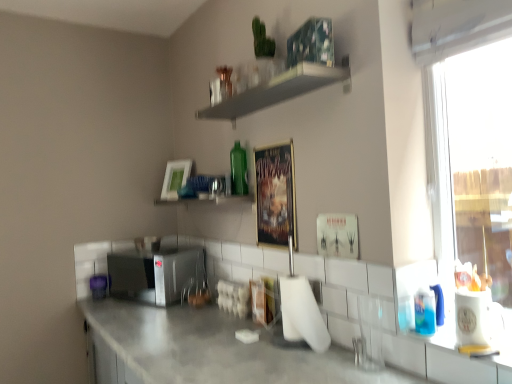
At what (x,y) coordinates should I click in order to perform the action: click on metallic poster at center, arranged as the 1th picture frame when viewed from the right. Please return your answer as a coordinate pair (x, y). Looking at the image, I should click on (275, 195).

Describe the element at coordinates (175, 178) in the screenshot. I see `white matte picture frame at upper center, placed as the 1th picture frame when sorted from left to right` at that location.

How much space does white matte picture frame at upper center, placed as the 1th picture frame when sorted from left to right, occupy vertically?

The height of white matte picture frame at upper center, placed as the 1th picture frame when sorted from left to right, is 29.55 centimeters.

What is the approximate height of transparent glass window at right?

transparent glass window at right is 3.45 feet in height.

Describe the element at coordinates (157, 274) in the screenshot. This screenshot has width=512, height=384. I see `satin silver microwave at center` at that location.

Measure the distance between green glass bottle at upper center and camera.

green glass bottle at upper center is 6.26 feet from camera.

The image size is (512, 384). What are the coordinates of `metallic poster at center, arranged as the 1th picture frame when viewed from the right` in the screenshot? It's located at tap(275, 195).

Is satin silver microwave at center inside or outside of metallic poster at center, the 2th picture frame when ordered from left to right?

satin silver microwave at center cannot be found inside metallic poster at center, the 2th picture frame when ordered from left to right.

From the image's perspective, between satin silver microwave at center and metallic poster at center, the 2th picture frame when ordered from back to front, who is located below?

satin silver microwave at center is shown below in the image.

From a real-world perspective, which object stands above the other?

metallic poster at center, the 1th picture frame from the front.

The height and width of the screenshot is (384, 512). Identify the location of the 2nd picture frame to the right of the satin silver microwave at center, starting your count from the anchor. (275, 195).

Does green glass bottle at upper center lie in front of white matte shelf at upper center, the second shelf when ordered from bottom to top?

No, green glass bottle at upper center is further to the viewer.

Identify the location of the 2nd shelf in front of the green glass bottle at upper center, starting your count from the anchor. (278, 90).

Is point (241, 170) farther from viewer compared to point (265, 100)?

Yes.

Is green glass bottle at upper center far away from white matte shelf at upper center, the 1th shelf when ordered from top to bottom?

No, there isn't a large distance between green glass bottle at upper center and white matte shelf at upper center, the 1th shelf when ordered from top to bottom.

Considering the relative sizes of transparent glass window at right and metallic poster at center, the 2th picture frame when ordered from back to front, in the image provided, is transparent glass window at right thinner than metallic poster at center, the 2th picture frame when ordered from back to front,?

No, transparent glass window at right is not thinner than metallic poster at center, the 2th picture frame when ordered from back to front.

Is transparent glass window at right positioned beyond the bounds of metallic poster at center, the 2th picture frame when ordered from back to front?

Yes, transparent glass window at right is outside of metallic poster at center, the 2th picture frame when ordered from back to front.

From a real-world perspective, is transparent glass window at right physically below metallic poster at center, the 2th picture frame when ordered from left to right?

Actually, transparent glass window at right is physically above metallic poster at center, the 2th picture frame when ordered from left to right, in the real world.

Which is in front, transparent glass window at right or metallic poster at center, arranged as the 1th picture frame when viewed from the right?

transparent glass window at right is more forward.

How many degrees apart are the facing directions of satin silver microwave at center and transparent glass window at right?

There is a 23.5-degree angle between the facing directions of satin silver microwave at center and transparent glass window at right.

This screenshot has height=384, width=512. Identify the location of window located on the right of satin silver microwave at center. (471, 162).

Based on the photo, considering the positions of objects satin silver microwave at center and transparent glass window at right in the image provided, who is more to the left, satin silver microwave at center or transparent glass window at right?

satin silver microwave at center is more to the left.

Is satin silver microwave at center far from transparent glass window at right?

Yes, satin silver microwave at center is far from transparent glass window at right.

Locate an element on the screen. the 1st shelf to the left when counting from the transparent glass window at right is located at coordinates (278, 90).

Is transparent glass window at right facing away from white matte shelf at upper center, the 1th shelf when ordered from top to bottom?

No.

Looking at their sizes, would you say transparent glass window at right is wider or thinner than white matte shelf at upper center, the 1th shelf when ordered from top to bottom?

transparent glass window at right is thinner than white matte shelf at upper center, the 1th shelf when ordered from top to bottom.

Could you tell me if green glass bottle at upper center, which is the 1th shelf from bottom to top, is turned towards metallic poster at center, arranged as the 1th picture frame when viewed from the right?

Answer: No, green glass bottle at upper center, which is the 1th shelf from bottom to top, is not aimed at metallic poster at center, arranged as the 1th picture frame when viewed from the right.

Considering the relative sizes of green glass bottle at upper center, the second shelf positioned from the top, and metallic poster at center, the 1th picture frame from the front, in the image provided, is green glass bottle at upper center, the second shelf positioned from the top, thinner than metallic poster at center, the 1th picture frame from the front,?

Incorrect, the width of green glass bottle at upper center, the second shelf positioned from the top, is not less than that of metallic poster at center, the 1th picture frame from the front.

In the scene shown: Is the depth of green glass bottle at upper center, which is the 1th shelf from bottom to top, less than that of metallic poster at center, the 1th picture frame from the front?

No, green glass bottle at upper center, which is the 1th shelf from bottom to top, is behind metallic poster at center, the 1th picture frame from the front.

Where is `picture frame on the right of green glass bottle at upper center, which is the 1th shelf from bottom to top`? picture frame on the right of green glass bottle at upper center, which is the 1th shelf from bottom to top is located at coordinates (275, 195).

From a real-world perspective, is white matte shelf at upper center, the second shelf when ordered from bottom to top, on white matte picture frame at upper center, the second picture frame positioned from the front?

Correct, in the physical world, white matte shelf at upper center, the second shelf when ordered from bottom to top, is higher than white matte picture frame at upper center, the second picture frame positioned from the front.

In the scene shown: Considering the relative sizes of white matte shelf at upper center, the 1th shelf when ordered from top to bottom, and white matte picture frame at upper center, the second picture frame positioned from the front, in the image provided, is white matte shelf at upper center, the 1th shelf when ordered from top to bottom, thinner than white matte picture frame at upper center, the second picture frame positioned from the front,?

No.

Considering the positions of objects white matte shelf at upper center, the 1th shelf when ordered from top to bottom, and white matte picture frame at upper center, placed as the 1th picture frame when sorted from left to right, in the image provided, who is behind, white matte shelf at upper center, the 1th shelf when ordered from top to bottom, or white matte picture frame at upper center, placed as the 1th picture frame when sorted from left to right,?

white matte picture frame at upper center, placed as the 1th picture frame when sorted from left to right, is behind.

Considering the points (217, 104) and (185, 180), which point is behind, point (217, 104) or point (185, 180)?

The point (185, 180) is behind.

I want to click on picture frame that is the 1st one above the satin silver microwave at center (from a real-world perspective), so click(x=275, y=195).

Where is `bottle behind the white matte shelf at upper center, the 1th shelf when ordered from top to bottom`? The width and height of the screenshot is (512, 384). bottle behind the white matte shelf at upper center, the 1th shelf when ordered from top to bottom is located at coordinates (238, 170).

Which object lies further to the anchor point white matte shelf at upper center, the second shelf when ordered from bottom to top, green glass bottle at upper center, which is the 1th shelf from bottom to top, or white matte picture frame at upper center, the 1th picture frame from the back?

white matte picture frame at upper center, the 1th picture frame from the back, is further to white matte shelf at upper center, the second shelf when ordered from bottom to top.

Considering their positions, is satin silver microwave at center positioned further to green glass bottle at upper center, which is the 1th shelf from bottom to top, than green glass bottle at upper center?

Among the two, satin silver microwave at center is located further to green glass bottle at upper center, which is the 1th shelf from bottom to top.

Estimate the real-world distances between objects in this image. Which object is further from green glass bottle at upper center, the second shelf positioned from the top, white matte picture frame at upper center, the 1th picture frame from the back, or metallic poster at center, the 1th picture frame from the front?

metallic poster at center, the 1th picture frame from the front, lies further to green glass bottle at upper center, the second shelf positioned from the top, than the other object.

Estimate the real-world distances between objects in this image. Which object is further from green glass bottle at upper center, which is the 1th shelf from bottom to top, satin silver microwave at center or white matte shelf at upper center, the 1th shelf when ordered from top to bottom?

Based on the image, white matte shelf at upper center, the 1th shelf when ordered from top to bottom, appears to be further to green glass bottle at upper center, which is the 1th shelf from bottom to top.

Estimate the real-world distances between objects in this image. Which object is further from satin silver microwave at center, green glass bottle at upper center, the second shelf positioned from the top, or green glass bottle at upper center?

Based on the image, green glass bottle at upper center appears to be further to satin silver microwave at center.

From the image, which object appears to be farther from green glass bottle at upper center, the second shelf positioned from the top, transparent glass window at right or green glass bottle at upper center?

transparent glass window at right lies further to green glass bottle at upper center, the second shelf positioned from the top, than the other object.

When comparing their distances from transparent glass window at right, does green glass bottle at upper center, which is the 1th shelf from bottom to top, or green glass bottle at upper center seem closer?

green glass bottle at upper center lies closer to transparent glass window at right than the other object.

From the image, which object appears to be farther from white matte picture frame at upper center, the 1th picture frame from the back, green glass bottle at upper center or green glass bottle at upper center, which is the 1th shelf from bottom to top?

The object further to white matte picture frame at upper center, the 1th picture frame from the back, is green glass bottle at upper center.

This screenshot has height=384, width=512. Find the location of `shelf between metallic poster at center, the 2th picture frame when ordered from left to right, and white matte picture frame at upper center, which appears as the second picture frame when viewed from the right, from front to back`. shelf between metallic poster at center, the 2th picture frame when ordered from left to right, and white matte picture frame at upper center, which appears as the second picture frame when viewed from the right, from front to back is located at coordinates (207, 200).

Locate an element on the screen. This screenshot has height=384, width=512. shelf between green glass bottle at upper center and satin silver microwave at center from top to bottom is located at coordinates (207, 200).

Locate an element on the screen. The height and width of the screenshot is (384, 512). bottle between satin silver microwave at center and metallic poster at center, arranged as the 1th picture frame when viewed from the right is located at coordinates (238, 170).

The height and width of the screenshot is (384, 512). What are the coordinates of `picture frame between green glass bottle at upper center, which is the 1th shelf from bottom to top, and transparent glass window at right` in the screenshot? It's located at (275, 195).